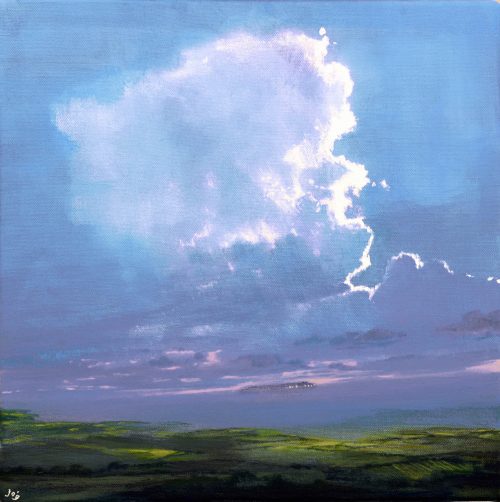
Locate an element on the screen. This screenshot has width=500, height=502. art is located at coordinates (225, 408).